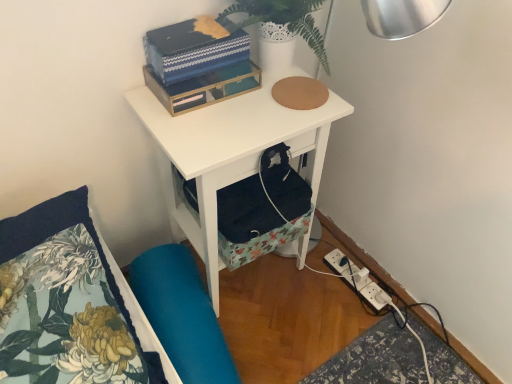
This screenshot has height=384, width=512. Identify the location of vacant region above white matte nightstand at upper center (from a real-world perspective). (247, 105).